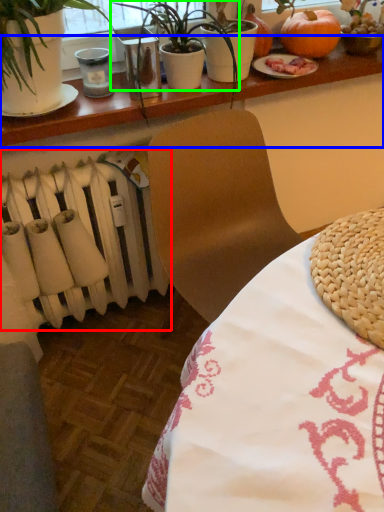
Question: Considering the real-world distances, which object is farthest from radiator (highlighted by a red box)? table (highlighted by a blue box) or houseplant (highlighted by a green box)?

Choices:
 (A) table
 (B) houseplant

Answer: (B)